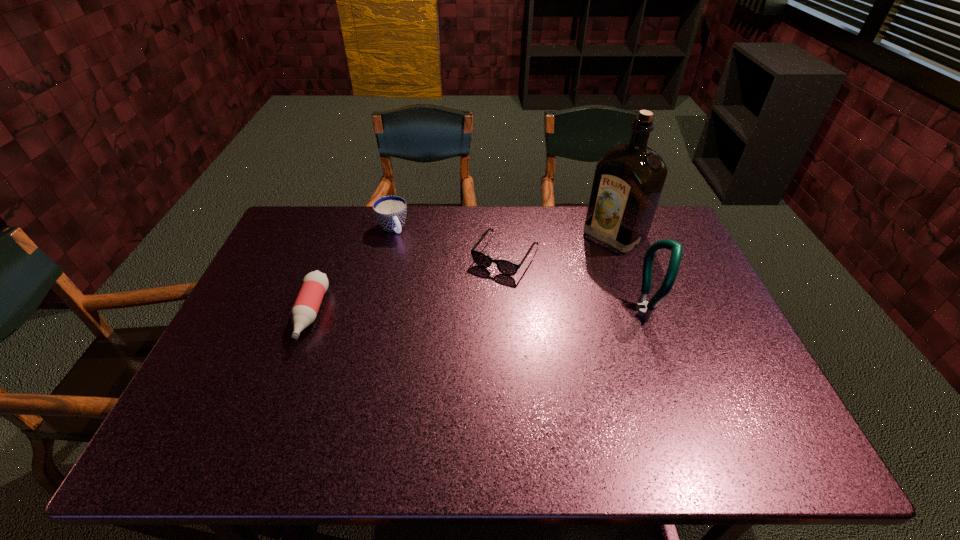
Where is `the second shortest object`? This screenshot has width=960, height=540. the second shortest object is located at coordinates (314, 285).

This screenshot has width=960, height=540. I want to click on bottle, so click(x=314, y=285).

Find the location of a particular element. The height and width of the screenshot is (540, 960). the second tallest object is located at coordinates (645, 308).

Where is `the fourth object from right to left`? This screenshot has width=960, height=540. the fourth object from right to left is located at coordinates (x=390, y=211).

Where is `the third shortest object`? the third shortest object is located at coordinates (390, 211).

Where is `liquor`? Image resolution: width=960 pixels, height=540 pixels. liquor is located at coordinates (628, 181).

Find the location of a particular element. This screenshot has height=540, width=960. the third object from right to left is located at coordinates (508, 268).

Image resolution: width=960 pixels, height=540 pixels. I want to click on the shortest object, so click(x=508, y=268).

At what (x,y) coordinates should I click in order to perform the action: click on vacant space located with the cap open on the leftmost object. Please return your answer as a coordinate pair (x, y). Looking at the image, I should click on (285, 382).

I want to click on vacant space situated 0.050m at the jaws of the bottle opener, so click(x=676, y=312).